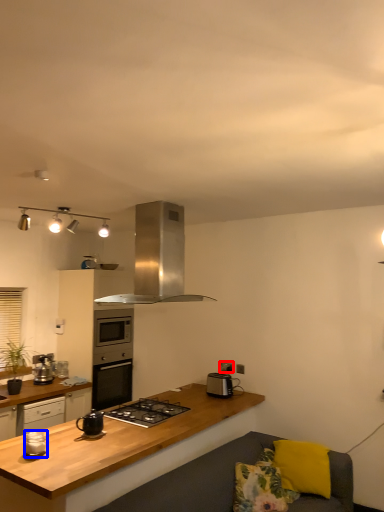
Question: Among these objects, which one is nearest to the camera, electric outlet (highlighted by a red box) or kitchen appliance (highlighted by a blue box)?

Choices:
 (A) electric outlet
 (B) kitchen appliance

Answer: (B)